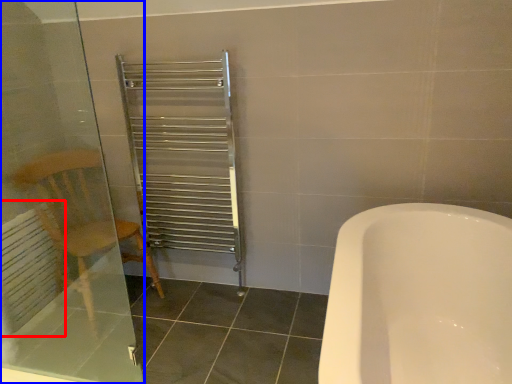
Question: Which point is further to the camera, radiator (highlighted by a red box) or screen door (highlighted by a blue box)?

Choices:
 (A) radiator
 (B) screen door

Answer: (A)